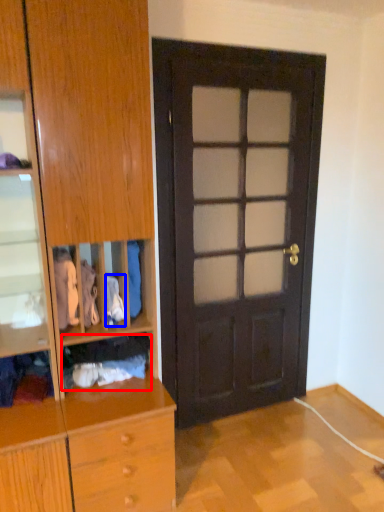
Question: Which of the following is the closest to the observer, clothing (highlighted by a red box) or clothing (highlighted by a blue box)?

Choices:
 (A) clothing
 (B) clothing

Answer: (B)